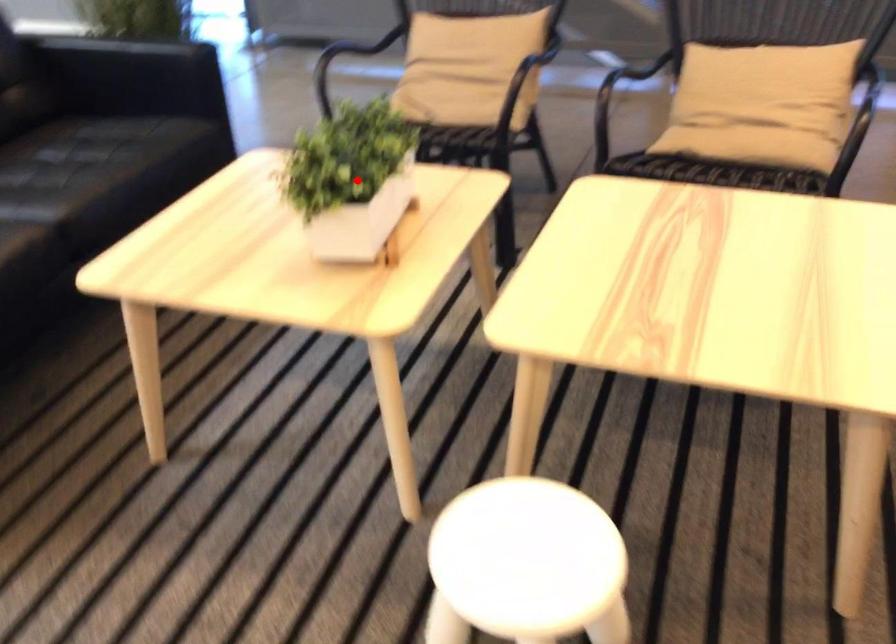
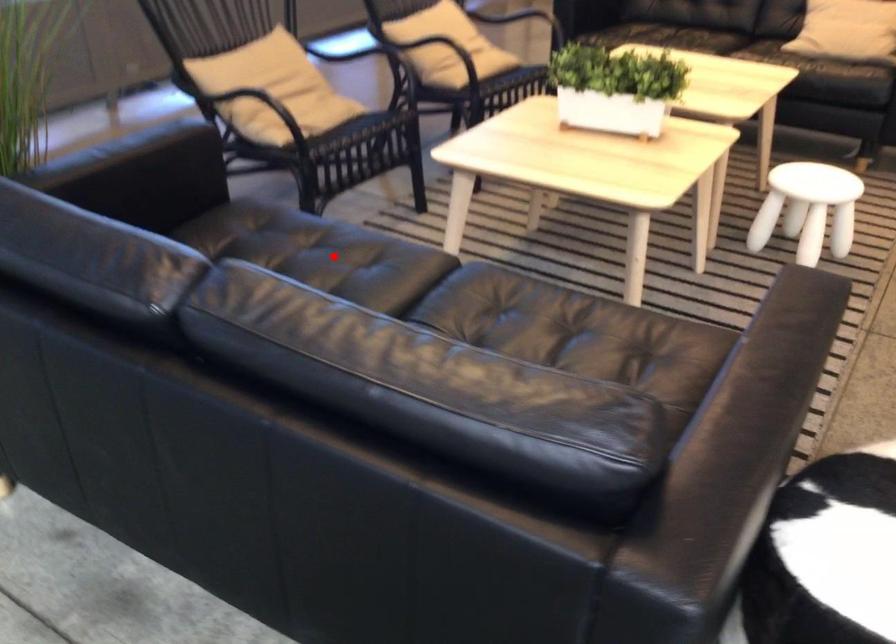
I am providing you with two images of the same scene from different viewpoints. A red point is marked on the first image and another point is marked on the second image. Do the highlighted points in image1 and image2 indicate the same real-world spot?

No